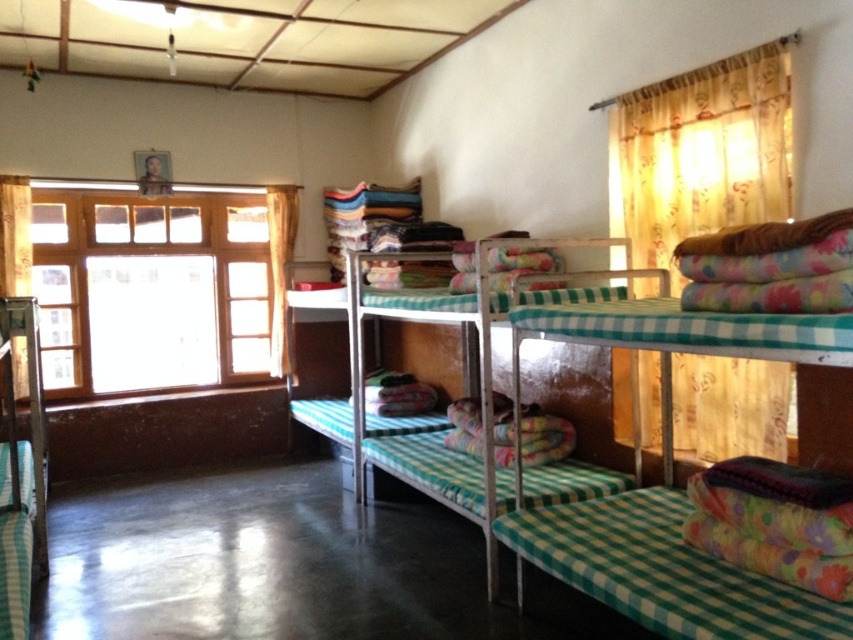
Question: Is green checkered bunk bed at center to the left of yellow fabric curtain at left from the viewer's perspective?

Choices:
 (A) yes
 (B) no

Answer: (B)

Question: Which object is the closest to the yellow floral fabric at upper right?

Choices:
 (A) green checkered bunk bed at center
 (B) wooden window at left

Answer: (A)

Question: Which is nearer to the green checkered bunk bed at center?

Choices:
 (A) yellow floral fabric at upper right
 (B) wooden window at left
 (C) yellow fabric curtain at left

Answer: (A)

Question: Does green checkered bunk bed at center appear on the left side of yellow floral fabric at upper right?

Choices:
 (A) no
 (B) yes

Answer: (B)

Question: Can you confirm if wooden window at left is positioned above yellow floral fabric at upper right?

Choices:
 (A) no
 (B) yes

Answer: (A)

Question: Which point appears farthest from the camera in this image?

Choices:
 (A) (706, 435)
 (B) (296, 202)
 (C) (218, 353)
 (D) (573, 570)

Answer: (B)